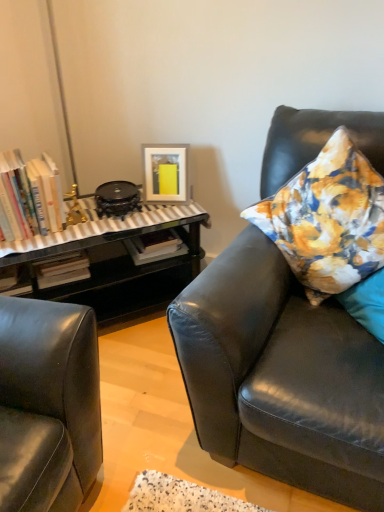
Question: Would you say matte white picture frame at upper center is a long distance from hardcover books at left?

Choices:
 (A) yes
 (B) no

Answer: (B)

Question: Is matte white picture frame at upper center shorter than hardcover books at left?

Choices:
 (A) yes
 (B) no

Answer: (A)

Question: Does matte white picture frame at upper center have a larger size compared to hardcover books at left?

Choices:
 (A) yes
 (B) no

Answer: (B)

Question: Considering the relative positions of matte white picture frame at upper center and hardcover books at left in the image provided, is matte white picture frame at upper center to the left of hardcover books at left from the viewer's perspective?

Choices:
 (A) no
 (B) yes

Answer: (A)

Question: Is matte white picture frame at upper center closer to camera compared to hardcover books at left?

Choices:
 (A) yes
 (B) no

Answer: (B)

Question: Is matte white picture frame at upper center in contact with hardcover books at left?

Choices:
 (A) yes
 (B) no

Answer: (B)

Question: From a real-world perspective, is matte black leather couch at right below matte white picture frame at upper center?

Choices:
 (A) no
 (B) yes

Answer: (B)

Question: From the image's perspective, is matte black leather couch at right on top of matte white picture frame at upper center?

Choices:
 (A) no
 (B) yes

Answer: (A)

Question: Is matte black leather couch at right positioned in front of matte white picture frame at upper center?

Choices:
 (A) yes
 (B) no

Answer: (A)

Question: Is matte black leather couch at right aimed at matte white picture frame at upper center?

Choices:
 (A) yes
 (B) no

Answer: (B)

Question: Is matte black leather couch at right facing away from matte white picture frame at upper center?

Choices:
 (A) yes
 (B) no

Answer: (B)

Question: Does matte black leather couch at right have a smaller size compared to matte white picture frame at upper center?

Choices:
 (A) yes
 (B) no

Answer: (B)

Question: From a real-world perspective, is matte white picture frame at upper center positioned under floral fabric pillow at right based on gravity?

Choices:
 (A) no
 (B) yes

Answer: (B)